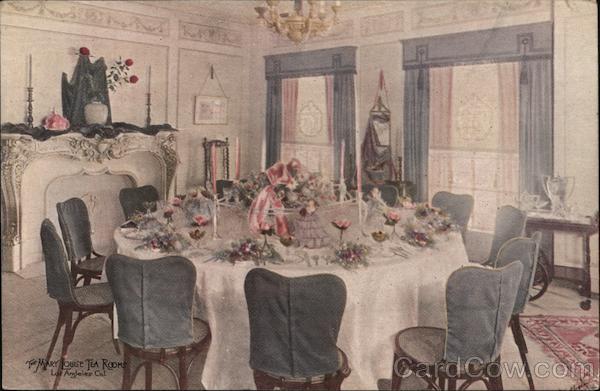
Where is `flower vase`? The image size is (600, 391). flower vase is located at coordinates (103, 113).